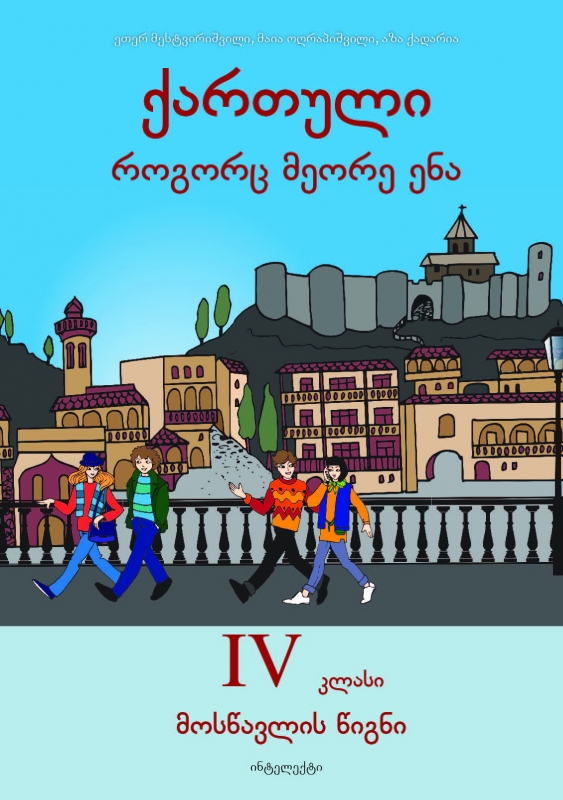
Find the location of `window`. window is located at coordinates (191, 396).